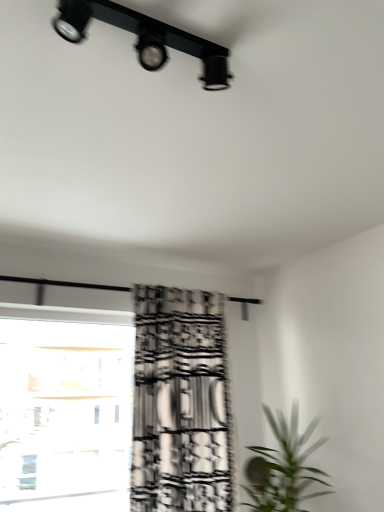
Question: Considering the relative sizes of transparent glass window at lower left and green leafy plant at lower right in the image provided, is transparent glass window at lower left bigger than green leafy plant at lower right?

Choices:
 (A) no
 (B) yes

Answer: (A)

Question: Is transparent glass window at lower left positioned behind green leafy plant at lower right?

Choices:
 (A) yes
 (B) no

Answer: (A)

Question: From a real-world perspective, is transparent glass window at lower left located beneath green leafy plant at lower right?

Choices:
 (A) yes
 (B) no

Answer: (B)

Question: Does transparent glass window at lower left touch green leafy plant at lower right?

Choices:
 (A) yes
 (B) no

Answer: (B)

Question: Is transparent glass window at lower left wider than green leafy plant at lower right?

Choices:
 (A) yes
 (B) no

Answer: (B)

Question: Considering the positions of black printed fabric curtain at center and black matte track light at upper center in the image, is black printed fabric curtain at center wider or thinner than black matte track light at upper center?

Choices:
 (A) wide
 (B) thin

Answer: (A)

Question: Considering the relative positions of black printed fabric curtain at center and black matte track light at upper center in the image provided, is black printed fabric curtain at center to the left or to the right of black matte track light at upper center?

Choices:
 (A) right
 (B) left

Answer: (A)

Question: Is point (216, 475) positioned closer to the camera than point (196, 52)?

Choices:
 (A) closer
 (B) farther

Answer: (B)

Question: From the image's perspective, relative to black matte track light at upper center, is black printed fabric curtain at center above or below?

Choices:
 (A) above
 (B) below

Answer: (B)

Question: Looking at the image, does black printed fabric curtain at center seem bigger or smaller compared to green leafy plant at lower right?

Choices:
 (A) small
 (B) big

Answer: (B)

Question: In the image, is black printed fabric curtain at center positioned in front of or behind green leafy plant at lower right?

Choices:
 (A) behind
 (B) front

Answer: (A)

Question: Considering the relative positions of black printed fabric curtain at center and green leafy plant at lower right in the image provided, is black printed fabric curtain at center to the left or to the right of green leafy plant at lower right?

Choices:
 (A) right
 (B) left

Answer: (B)

Question: From the image's perspective, is black printed fabric curtain at center located above or below green leafy plant at lower right?

Choices:
 (A) below
 (B) above

Answer: (B)

Question: Is green leafy plant at lower right situated inside black matte track light at upper center or outside?

Choices:
 (A) inside
 (B) outside

Answer: (B)

Question: From their relative heights in the image, would you say green leafy plant at lower right is taller or shorter than black matte track light at upper center?

Choices:
 (A) short
 (B) tall

Answer: (B)